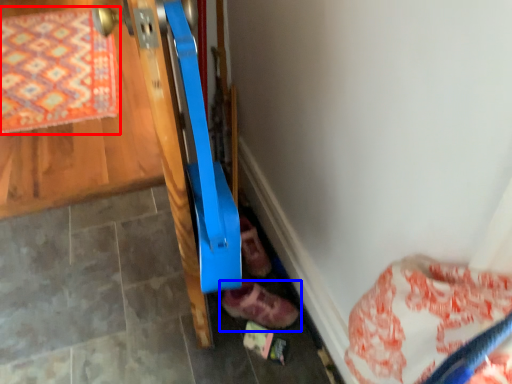
Question: Which object appears closest to the camera in this image, mat (highlighted by a red box) or footwear (highlighted by a blue box)?

Choices:
 (A) mat
 (B) footwear

Answer: (B)